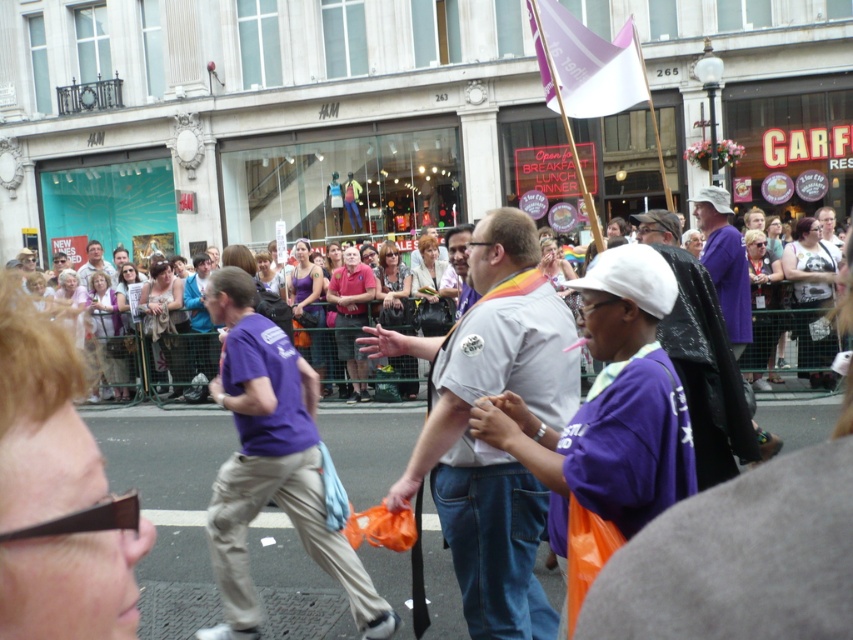
Question: Estimate the real-world distances between objects in this image. Which object is closer to the light gray shirt at center?

Choices:
 (A) purple fabric flag at upper center
 (B) purple fabric shirt at center
 (C) matte purple shirt at center
 (D) purple cotton shirt at center

Answer: (D)

Question: Is purple cotton shirt at center to the left of purple fabric flag at upper center from the viewer's perspective?

Choices:
 (A) yes
 (B) no

Answer: (A)

Question: Can you confirm if purple fabric shirt at center is positioned to the right of matte purple shirt at center?

Choices:
 (A) no
 (B) yes

Answer: (B)

Question: Which point appears farthest from the camera in this image?

Choices:
 (A) (569, 17)
 (B) (514, 474)

Answer: (A)

Question: Where is light gray shirt at center located in relation to matte purple shirt at center in the image?

Choices:
 (A) above
 (B) below

Answer: (B)

Question: Which object is the closest to the light gray shirt at center?

Choices:
 (A) purple cotton shirt at center
 (B) purple fabric flag at upper center

Answer: (A)